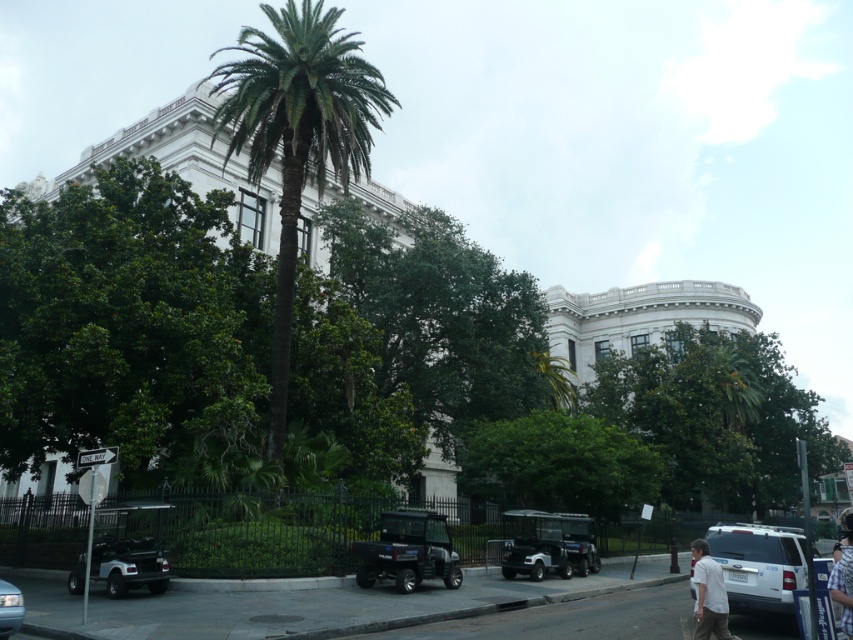
Question: Which of these objects is positioned farthest from the white matte suv at lower right?

Choices:
 (A) black matte golf cart at center
 (B) white cotton shirt at lower right

Answer: (A)

Question: Is green leafy palm tree at center to the right of black matte golf cart at lower left from the viewer's perspective?

Choices:
 (A) yes
 (B) no

Answer: (B)

Question: Does green leafy tree at center have a smaller size compared to black matte utility vehicle at center?

Choices:
 (A) yes
 (B) no

Answer: (B)

Question: Which of the following is the farthest from the observer?

Choices:
 (A) white cotton shirt at lower right
 (B) black matte golf cart at lower left
 (C) white matte suv at lower right
 (D) black matte utility vehicle at center

Answer: (D)

Question: Among these points, which one is farthest from the camera?

Choices:
 (A) (10, 612)
 (B) (53, 310)
 (C) (839, 572)

Answer: (B)

Question: Is green leafy palm tree at center further to camera compared to black matte golf cart at lower left?

Choices:
 (A) yes
 (B) no

Answer: (A)